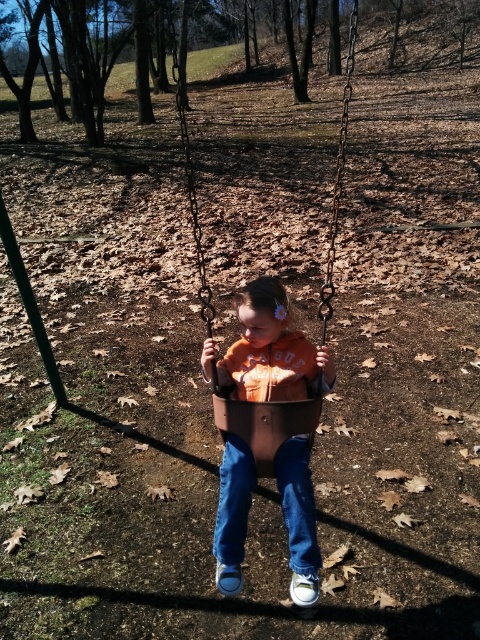
Question: Which point appears closest to the camera in this image?

Choices:
 (A) tap(228, 435)
 (B) tap(204, 268)
 (C) tap(244, 305)

Answer: (C)

Question: In this image, where is brown leather swing at center located relative to denim at center?

Choices:
 (A) below
 (B) above

Answer: (B)

Question: Does brown leather swing at center have a greater width compared to denim at center?

Choices:
 (A) no
 (B) yes

Answer: (B)

Question: Which point is farther to the camera?

Choices:
 (A) brown leather swing at center
 (B) denim at center

Answer: (A)

Question: Does matte orange hoodie at center appear on the left side of denim at center?

Choices:
 (A) yes
 (B) no

Answer: (B)

Question: Which point appears farthest from the camera in this image?

Choices:
 (A) (244, 452)
 (B) (178, 93)

Answer: (B)